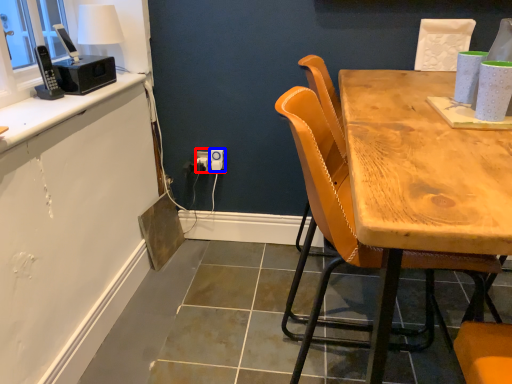
Question: Which object is further to the camera taking this photo, electric outlet (highlighted by a red box) or power outlet (highlighted by a blue box)?

Choices:
 (A) electric outlet
 (B) power outlet

Answer: (A)